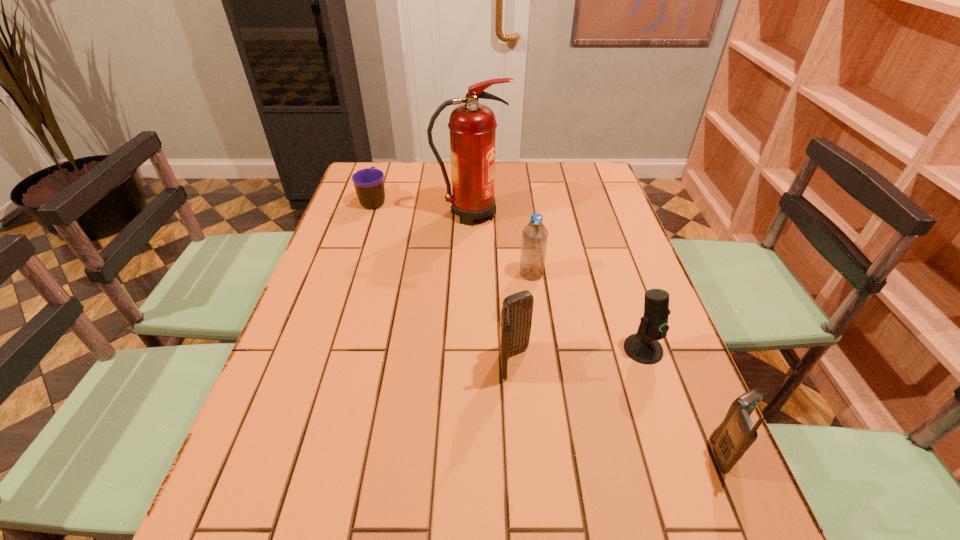
Locate which object ranks third in proximity to the fourth nearest object. Please provide its 2D coordinates. Your answer should be formatted as a tuple, i.e. [(x, y)], where the tuple contains the x and y coordinates of a point satisfying the conditions above.

[(643, 347)]

The image size is (960, 540). What are the coordinates of `vacant space that satisfies the following two spatial constraints: 1. on the back side of the water bottle; 2. on the front-facing side of the tallest object` in the screenshot? It's located at (523, 213).

Locate an element on the screen. Image resolution: width=960 pixels, height=540 pixels. free space that satisfies the following two spatial constraints: 1. on the front-facing side of the tallest object; 2. on the right side of the third farthest object is located at coordinates (469, 273).

Locate an element on the screen. The width and height of the screenshot is (960, 540). free region that satisfies the following two spatial constraints: 1. on the front side of the microphone; 2. on the keyboard of the farther cellular telephone is located at coordinates (648, 362).

What are the coordinates of `vacant space that satisfies the following two spatial constraints: 1. on the back side of the microphone; 2. on the front-facing side of the tallest object` in the screenshot? It's located at (596, 213).